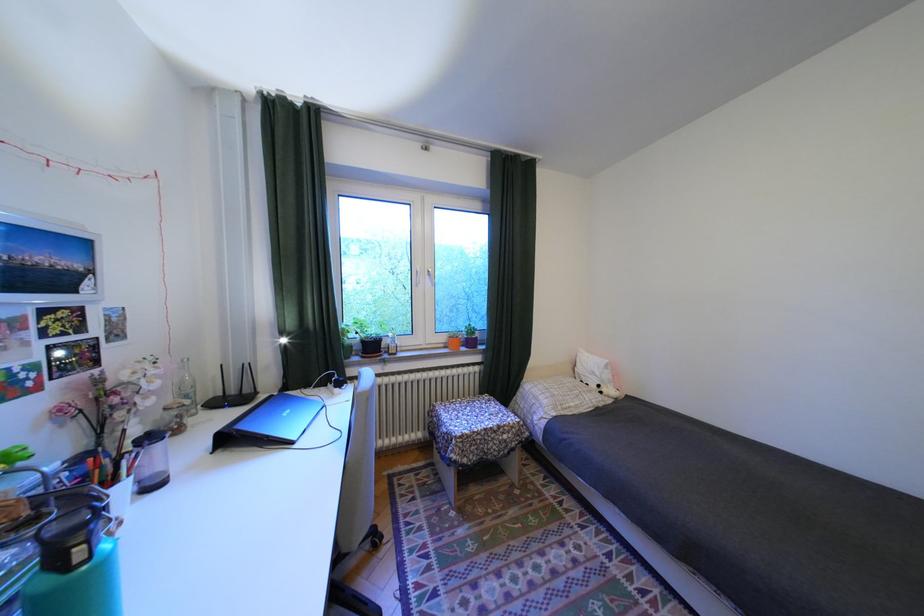
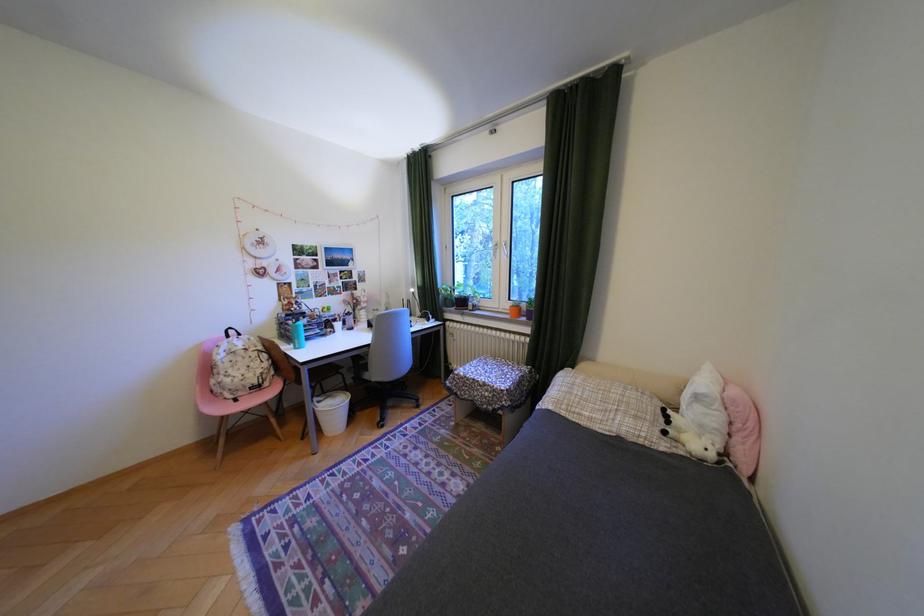
In the second image, find the point that corresponds to pixel 384 347 in the first image.

(475, 302)